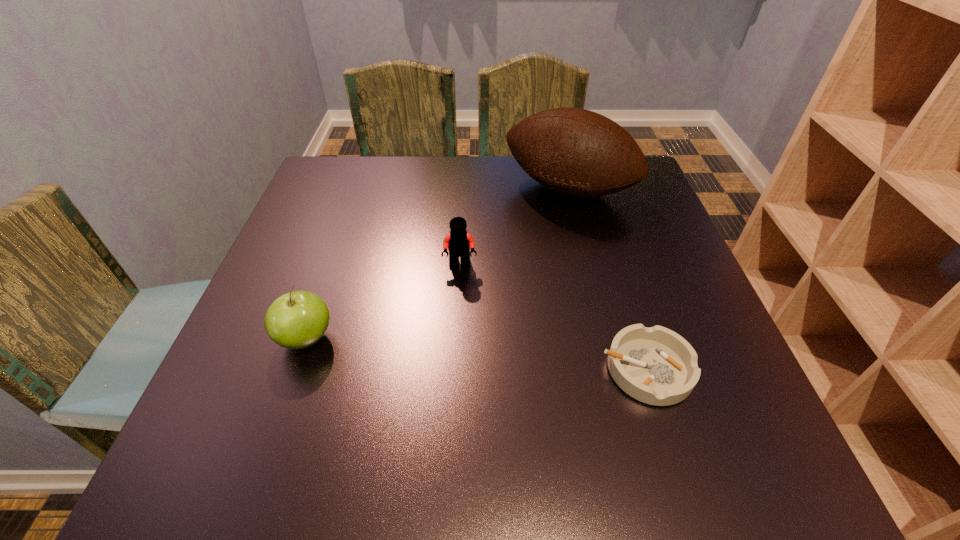
Identify the location of vacant spot on the desktop that is between the apple and the ashtray and is positioned on the laces of the football. (462, 353).

Where is `free spot on the desktop that is between the leftmost object and the shortest object and is positioned on the front-facing side of the third nearest object`? The image size is (960, 540). free spot on the desktop that is between the leftmost object and the shortest object and is positioned on the front-facing side of the third nearest object is located at coordinates (450, 352).